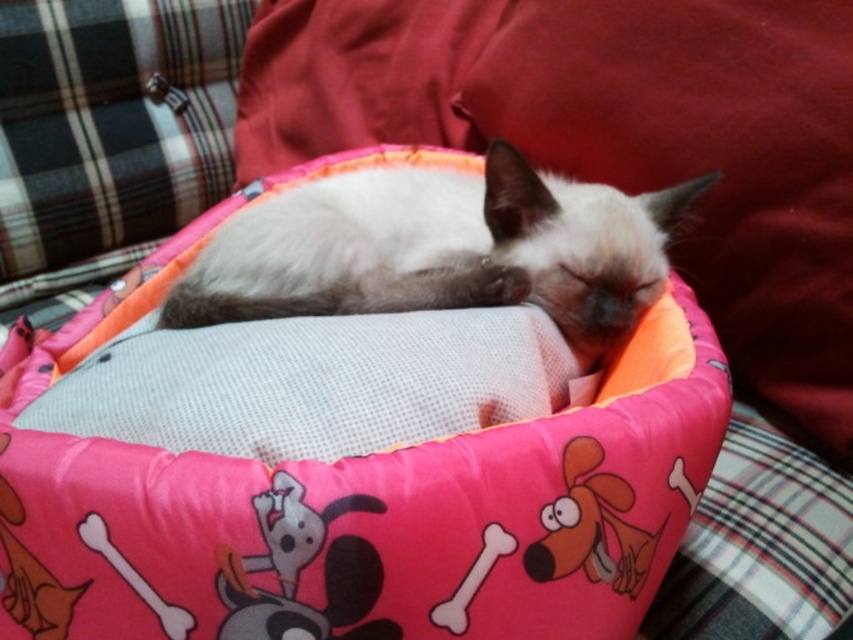
Does pink fabric bean bag chair at center come behind silky white cat at center?

No, pink fabric bean bag chair at center is closer to the viewer.

Image resolution: width=853 pixels, height=640 pixels. Find the location of `pink fabric bean bag chair at center`. pink fabric bean bag chair at center is located at coordinates [x=358, y=506].

The image size is (853, 640). Find the location of `pink fabric bean bag chair at center`. pink fabric bean bag chair at center is located at coordinates (358, 506).